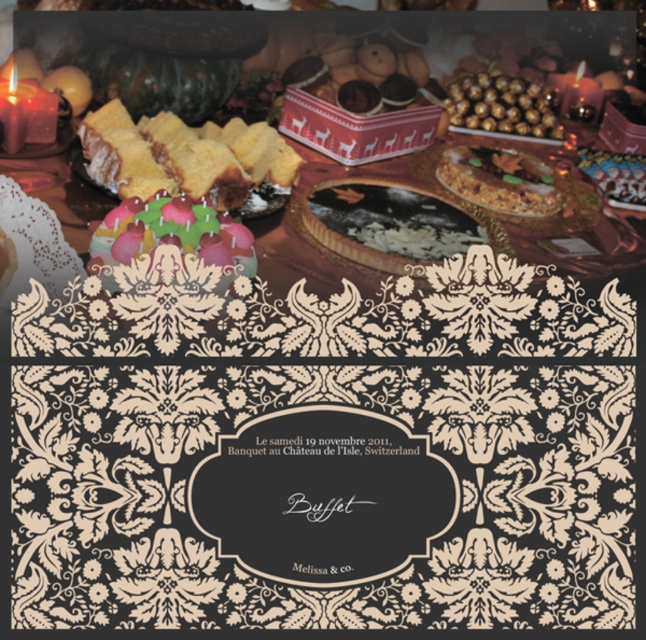
Can you confirm if spongy golden cake at center is positioned below chocolate frosted cake at center?

Incorrect, spongy golden cake at center is not positioned below chocolate frosted cake at center.

Who is shorter, spongy golden cake at center or chocolate frosted cake at center?

chocolate frosted cake at center is shorter.

Identify the location of spongy golden cake at center. (182, 156).

This screenshot has width=646, height=640. Identify the location of spongy golden cake at center. (182, 156).

Between multicolored fondant cake at center and gold foil wrapped chocolates at upper center, which one appears on the left side from the viewer's perspective?

From the viewer's perspective, multicolored fondant cake at center appears more on the left side.

Who is taller, multicolored fondant cake at center or gold foil wrapped chocolates at upper center?

gold foil wrapped chocolates at upper center is taller.

Is point (178, 237) in front of point (519, 124)?

Yes, it is.

Identify the location of multicolored fondant cake at center. (172, 234).

Between white glossy pie at center and pastel frosted cake at left, which one has less height?

pastel frosted cake at left is shorter.

Can you confirm if white glossy pie at center is taller than pastel frosted cake at left?

Indeed, white glossy pie at center has a greater height compared to pastel frosted cake at left.

Between point (417, 211) and point (3, 257), which one is positioned in front?

Point (3, 257)

Where is `white glossy pie at center`? This screenshot has width=646, height=640. white glossy pie at center is located at coordinates (390, 224).